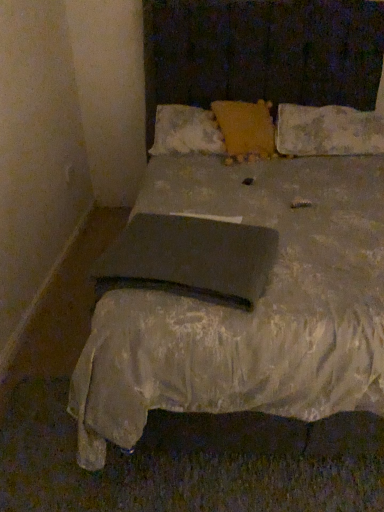
Question: Is yellow textured pillow at center, which appears as the third pillow when viewed from the right, wider than fluffy yellow pillow at center, positioned as the second pillow in right-to-left order?

Choices:
 (A) yes
 (B) no

Answer: (B)

Question: Considering the relative sizes of yellow textured pillow at center, the first pillow viewed from the left, and fluffy yellow pillow at center, the second pillow viewed from the left, in the image provided, is yellow textured pillow at center, the first pillow viewed from the left, shorter than fluffy yellow pillow at center, the second pillow viewed from the left,?

Choices:
 (A) yes
 (B) no

Answer: (A)

Question: Is yellow textured pillow at center, the first pillow viewed from the left, further to camera compared to fluffy yellow pillow at center, the second pillow viewed from the left?

Choices:
 (A) no
 (B) yes

Answer: (B)

Question: Is yellow textured pillow at center, the first pillow viewed from the left, with fluffy yellow pillow at center, positioned as the second pillow in right-to-left order?

Choices:
 (A) no
 (B) yes

Answer: (A)

Question: From the image's perspective, is yellow textured pillow at center, the first pillow viewed from the left, beneath fluffy yellow pillow at center, the second pillow viewed from the left?

Choices:
 (A) yes
 (B) no

Answer: (B)

Question: Is yellow textured pillow at center, which appears as the third pillow when viewed from the right, far away from fluffy yellow pillow at center, the second pillow viewed from the left?

Choices:
 (A) yes
 (B) no

Answer: (B)

Question: Does worn fabric pillow at upper right, positioned as the third pillow in left-to-right order, have a larger size compared to fluffy yellow pillow at center, the second pillow viewed from the left?

Choices:
 (A) yes
 (B) no

Answer: (A)

Question: Is worn fabric pillow at upper right, positioned as the 1th pillow in right-to-left order, oriented towards fluffy yellow pillow at center, positioned as the second pillow in right-to-left order?

Choices:
 (A) no
 (B) yes

Answer: (A)

Question: Is worn fabric pillow at upper right, positioned as the third pillow in left-to-right order, at the right side of fluffy yellow pillow at center, positioned as the second pillow in right-to-left order?

Choices:
 (A) no
 (B) yes

Answer: (B)

Question: Does worn fabric pillow at upper right, positioned as the 1th pillow in right-to-left order, touch fluffy yellow pillow at center, the second pillow viewed from the left?

Choices:
 (A) yes
 (B) no

Answer: (B)

Question: Considering the relative positions of worn fabric pillow at upper right, positioned as the third pillow in left-to-right order, and fluffy yellow pillow at center, positioned as the second pillow in right-to-left order, in the image provided, is worn fabric pillow at upper right, positioned as the third pillow in left-to-right order, behind fluffy yellow pillow at center, positioned as the second pillow in right-to-left order,?

Choices:
 (A) yes
 (B) no

Answer: (A)

Question: Is worn fabric pillow at upper right, positioned as the third pillow in left-to-right order, closer to camera compared to fluffy yellow pillow at center, the second pillow viewed from the left?

Choices:
 (A) no
 (B) yes

Answer: (A)

Question: Is fluffy yellow pillow at center, positioned as the second pillow in right-to-left order, wider than matte black pad at center?

Choices:
 (A) yes
 (B) no

Answer: (B)